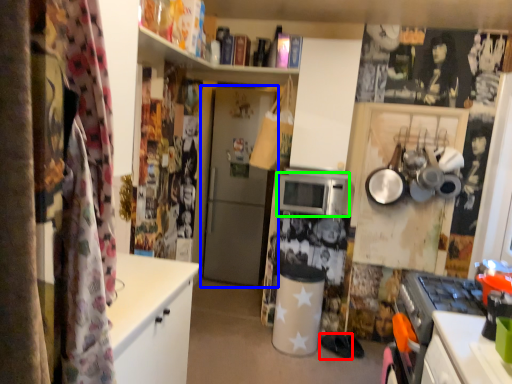
Question: Which is nearer to the footwear (highlighted by a red box)? door (highlighted by a blue box) or microwave oven (highlighted by a green box).

Choices:
 (A) door
 (B) microwave oven

Answer: (B)